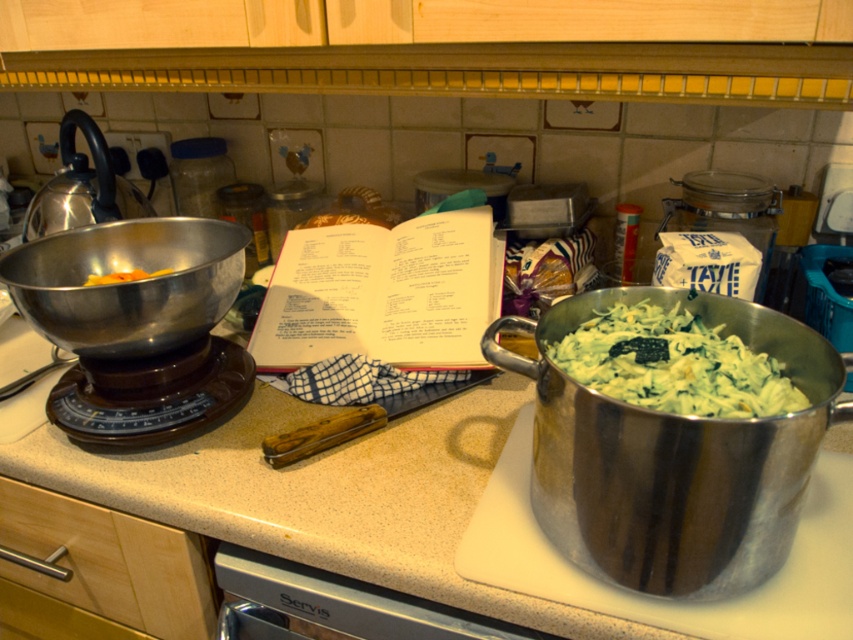
You are organizing items on the beige laminate countertop at center and the yellow rubber band at left. If you want to place a new item closer to the viewer, where should you put it?

The beige laminate countertop at center is closer to the viewer than the yellow rubber band at left, so placing the new item on the beige laminate countertop at center would position it closer to the viewer.

You are organizing items on the beige laminate countertop at center and notice the yellow rubber band at left. Where is the yellow rubber band located relative to the countertop?

The yellow rubber band at left is positioned above the beige laminate countertop at center.